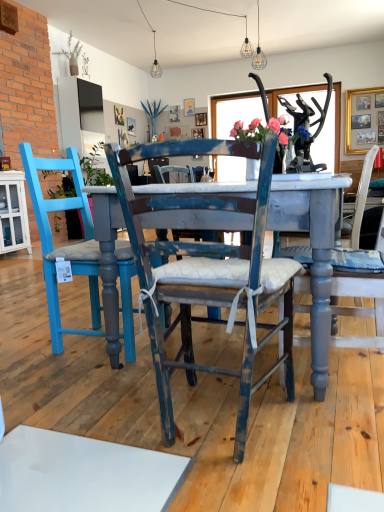
Question: Can you confirm if matte blue vase with pink roses at center is wider than distressed blue chair at center, which appears as the 2th chair when viewed from the right?

Choices:
 (A) yes
 (B) no

Answer: (B)

Question: From the image's perspective, would you say matte blue vase with pink roses at center is positioned over distressed blue chair at center, which appears as the 2th chair when viewed from the right?

Choices:
 (A) yes
 (B) no

Answer: (A)

Question: Is matte blue vase with pink roses at center facing away from distressed blue chair at center, acting as the second chair starting from the left?

Choices:
 (A) yes
 (B) no

Answer: (B)

Question: Is matte blue vase with pink roses at center at the right side of distressed blue chair at center, which appears as the 2th chair when viewed from the right?

Choices:
 (A) yes
 (B) no

Answer: (A)

Question: Could you tell me if matte blue vase with pink roses at center is turned towards distressed blue chair at center, acting as the second chair starting from the left?

Choices:
 (A) yes
 (B) no

Answer: (B)

Question: From the image's perspective, relative to gold-framed picture at upper right, is distressed blue chair at center, acting as the second chair starting from the left, above or below?

Choices:
 (A) below
 (B) above

Answer: (A)

Question: In terms of height, does distressed blue chair at center, acting as the second chair starting from the left, look taller or shorter compared to gold-framed picture at upper right?

Choices:
 (A) short
 (B) tall

Answer: (A)

Question: Looking at their shapes, would you say distressed blue chair at center, acting as the second chair starting from the left, is wider or thinner than gold-framed picture at upper right?

Choices:
 (A) thin
 (B) wide

Answer: (B)

Question: Considering the positions of distressed blue chair at center, acting as the second chair starting from the left, and gold-framed picture at upper right in the image, is distressed blue chair at center, acting as the second chair starting from the left, bigger or smaller than gold-framed picture at upper right?

Choices:
 (A) big
 (B) small

Answer: (A)

Question: Is point (64, 163) positioned closer to the camera than point (203, 275)?

Choices:
 (A) closer
 (B) farther

Answer: (B)

Question: From a real-world perspective, is blue painted wood chair at left, the 1th chair positioned from the left, above or below distressed blue chair at center, which appears as the 2th chair when viewed from the right?

Choices:
 (A) below
 (B) above

Answer: (B)

Question: Is blue painted wood chair at left, the 1th chair positioned from the left, inside the boundaries of distressed blue chair at center, acting as the second chair starting from the left, or outside?

Choices:
 (A) inside
 (B) outside

Answer: (B)

Question: Considering the relative positions of blue painted wood chair at left, positioned as the 3th chair in right-to-left order, and distressed blue chair at center, which appears as the 2th chair when viewed from the right, in the image provided, is blue painted wood chair at left, positioned as the 3th chair in right-to-left order, to the left or to the right of distressed blue chair at center, which appears as the 2th chair when viewed from the right,?

Choices:
 (A) right
 (B) left

Answer: (B)

Question: Is distressed blue chair at center, acting as the second chair starting from the left, inside or outside of matte blue vase with pink roses at center?

Choices:
 (A) outside
 (B) inside

Answer: (A)

Question: From the image's perspective, is distressed blue chair at center, acting as the second chair starting from the left, positioned above or below matte blue vase with pink roses at center?

Choices:
 (A) below
 (B) above

Answer: (A)